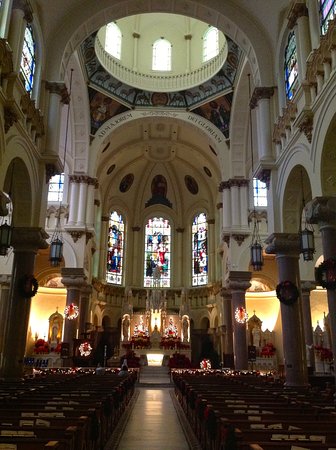
Locate an element on the screen. wreath is located at coordinates (33, 292), (75, 313), (86, 351), (206, 366), (240, 315), (293, 299), (320, 281).